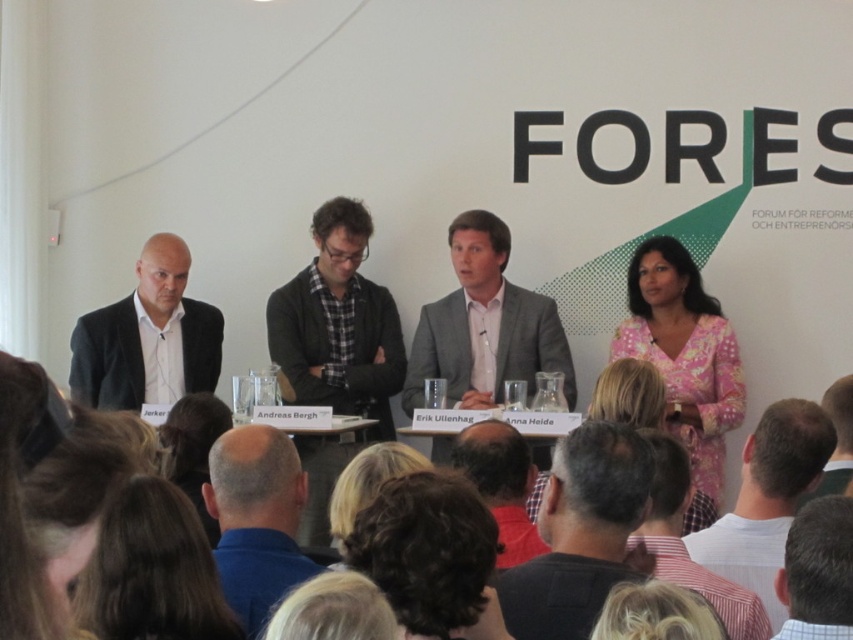
You are an event photographer at the FORE forum. You need to ensure that all panelists are visible in the group photo. The pink floral dress at right and the dark brown curly hair at lower center are two of the panelists. Since the camera has a limited focus range, which panelist should you prioritize positioning closer to the center to ensure visibility?

The pink floral dress at right should be positioned closer to the center because its width is larger than the dark brown curly hair at lower center, making it more likely to be partially obscured if not centered.

You are an event photographer at the FORE forum. You need to capture a closeup shot of the dark gray shirt at center and the dark brown hair at lower center. Which one would you need to zoom in more on to get a clear image?

The dark gray shirt at center is larger in size than the dark brown hair at lower center, so you would need to zoom in more on the dark brown hair at lower center to get a clear image.

You are a photographer at the event and want to capture a photo that includes both the panelists and the backdrop text. You notice two points of interest marked as point 1 at coordinates (735, 385) and point 2 at coordinates (399, 592). Which point is closer to the camera, and how does this affect your framing?

Point 1 at coordinates (735, 385) is closer to the camera than point 2 at coordinates (399, 592). This means when framing, the panelists near point 1 will appear larger and more prominent in the foreground, while the backdrop text near point 2 will be slightly smaller and further back, creating depth in the image.